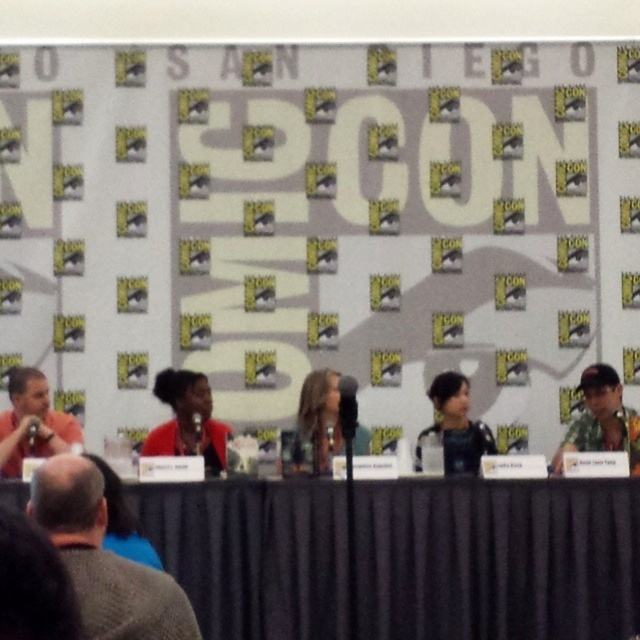
Who is positioned more to the left, black fabric table at lower center or matte orange shirt at left?

Positioned to the left is matte orange shirt at left.

Does black fabric table at lower center have a greater width compared to matte orange shirt at left?

Yes.

Locate an element on the screen. This screenshot has width=640, height=640. black fabric table at lower center is located at coordinates (497, 557).

Between gray wool sweater at lower left and black matte jacket at center, which one is positioned lower?

gray wool sweater at lower left

Which is more to the left, gray wool sweater at lower left or black matte jacket at center?

From the viewer's perspective, gray wool sweater at lower left appears more on the left side.

This screenshot has height=640, width=640. I want to click on gray wool sweater at lower left, so click(x=104, y=557).

You are a GUI agent. You are given a task and a screenshot of the screen. Output one action in this format:
    pyautogui.click(x=<x>, y=<y>)
    Task: Click on the gray wool sweater at lower left
    Image resolution: width=640 pixels, height=640 pixels.
    Given the screenshot: What is the action you would take?
    tap(104, 557)

Between point (80, 480) and point (625, 438), which one is positioned in front?

Point (80, 480) is in front.

Find the location of a particular element. gray wool sweater at lower left is located at coordinates (104, 557).